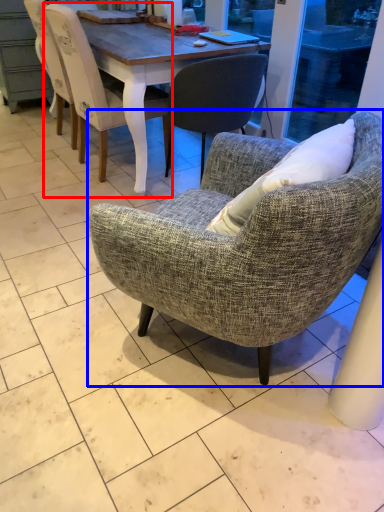
Question: Among these objects, which one is nearest to the camera, chair (highlighted by a red box) or chair (highlighted by a blue box)?

Choices:
 (A) chair
 (B) chair

Answer: (B)